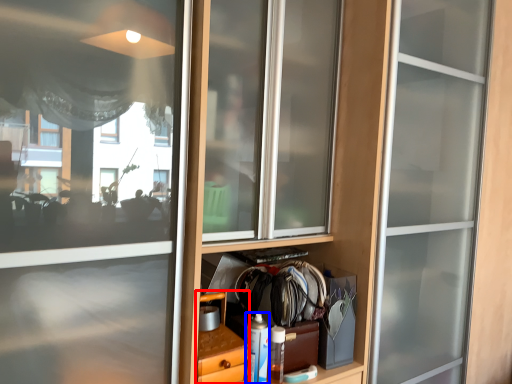
Question: Which object is closer to the camera taking this photo, cabinetry (highlighted by a red box) or bottle (highlighted by a blue box)?

Choices:
 (A) cabinetry
 (B) bottle

Answer: (A)